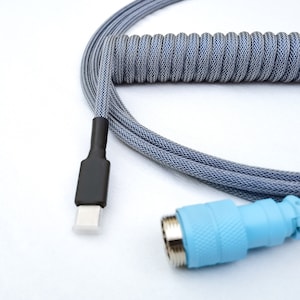
Locate an element on the screen. The height and width of the screenshot is (300, 300). rolled up cord is located at coordinates (171, 57), (157, 63), (128, 62), (201, 57), (248, 60), (269, 60), (284, 61).